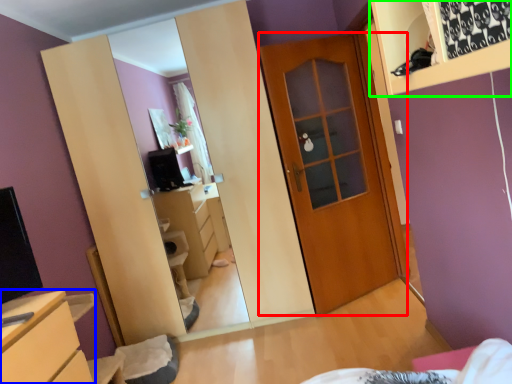
Question: Considering the real-world distances, which object is farthest from door (highlighted by a red box)? chest of drawers (highlighted by a blue box) or shelf (highlighted by a green box)?

Choices:
 (A) chest of drawers
 (B) shelf

Answer: (B)